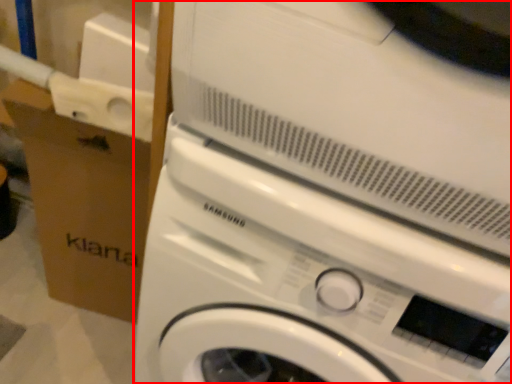
Question: From the image, what is the correct spatial relationship of washing machine (annotated by the red box) in relation to cardboard box?

Choices:
 (A) right
 (B) left

Answer: (A)